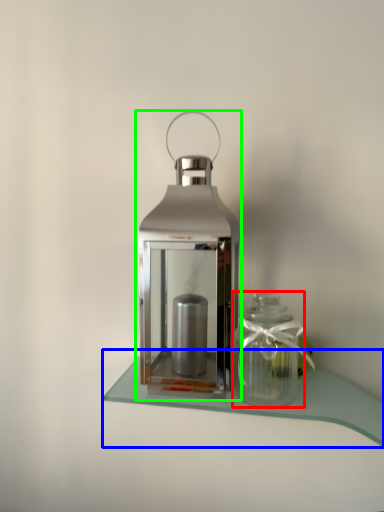
Question: Which object is the closest to the glass vase (highlighted by a red box)? Choose among these: table (highlighted by a blue box) or lantern (highlighted by a green box).

Choices:
 (A) table
 (B) lantern

Answer: (A)